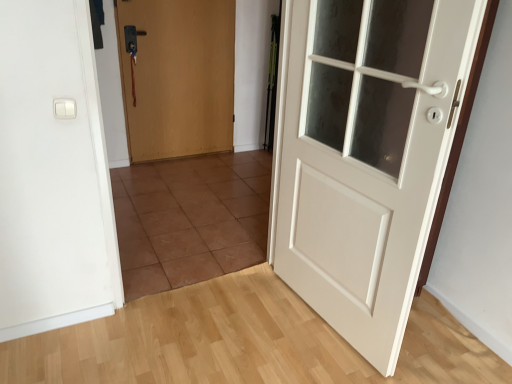
Question: Considering the positions of point (189, 276) and point (320, 157), is point (189, 276) closer or farther from the camera than point (320, 157)?

Choices:
 (A) farther
 (B) closer

Answer: (A)

Question: From the image's perspective, is brown tile at center positioned above or below white matte door at right, which is the 1th door from right to left?

Choices:
 (A) above
 (B) below

Answer: (B)

Question: Estimate the real-world distances between objects in this image. Which object is farther from the wooden door at center, the first door viewed from the left?

Choices:
 (A) brown tile at center
 (B) white matte door at right, arranged as the second door when viewed from the back
 (C) white plastic light switch at upper left

Answer: (C)

Question: Considering the real-world distances, which object is closest to the white matte door at right, which is the 1th door from right to left?

Choices:
 (A) white plastic light switch at upper left
 (B) brown tile at center
 (C) wooden door at center, the first door viewed from the left

Answer: (B)